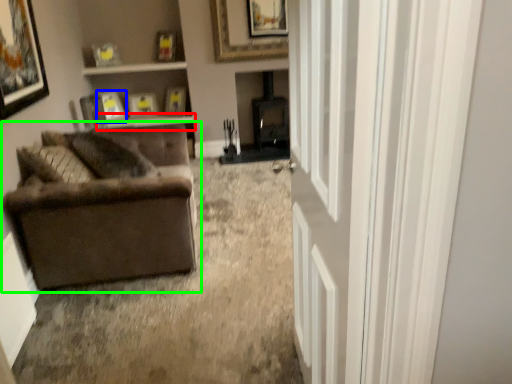
Question: Which object is the farthest from window sill (highlighted by a red box)? Choose among these: picture frame (highlighted by a blue box) or studio couch (highlighted by a green box).

Choices:
 (A) picture frame
 (B) studio couch

Answer: (B)